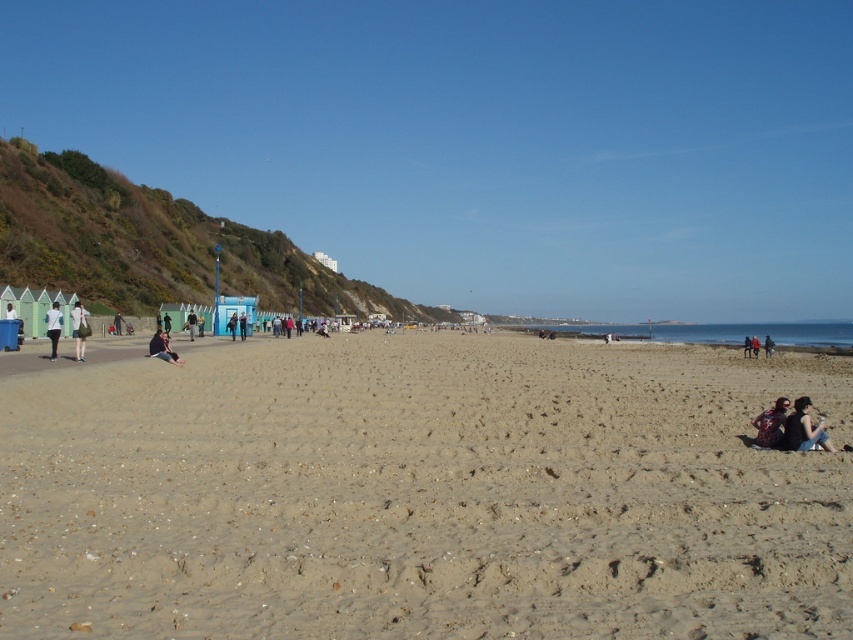
Question: Which point is closer to the camera?

Choices:
 (A) (49, 333)
 (B) (769, 428)

Answer: (B)

Question: Considering the relative positions of white cotton shorts at left and dark blue fabric jacket at center in the image provided, where is white cotton shorts at left located with respect to dark blue fabric jacket at center?

Choices:
 (A) below
 (B) above

Answer: (B)

Question: Which point appears farthest from the camera in this image?

Choices:
 (A) (74, 355)
 (B) (785, 401)
 (C) (163, 512)

Answer: (A)

Question: Which of the following is the closest to the observer?

Choices:
 (A) (244, 337)
 (B) (764, 356)
 (C) (163, 342)

Answer: (C)

Question: Does matte black hair at lower right appear over light blue plastic chair at center-left?

Choices:
 (A) yes
 (B) no

Answer: (B)

Question: Can you confirm if light blue plastic chair at center-left is wider than red fabric person at lower right?

Choices:
 (A) yes
 (B) no

Answer: (A)